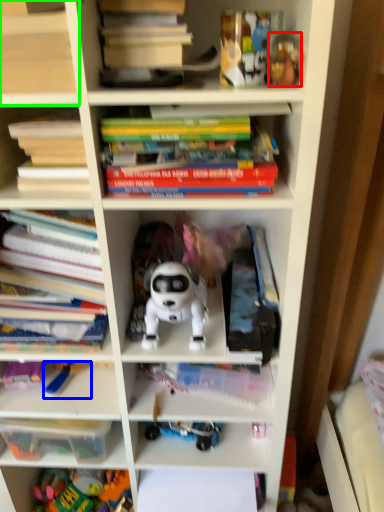
Question: Which object is the farthest from toy (highlighted by a red box)? Choose among these: toy (highlighted by a blue box) or shelf (highlighted by a green box).

Choices:
 (A) toy
 (B) shelf

Answer: (A)